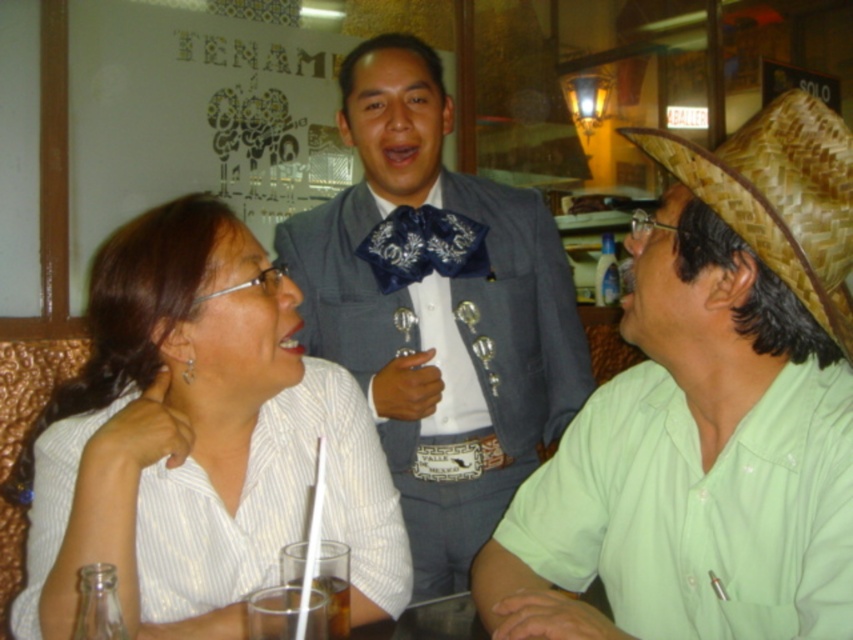
Is matte gray suit at center wider than translucent glass at table center?

Indeed, matte gray suit at center has a greater width compared to translucent glass at table center.

Is point (376, 420) more distant than point (329, 627)?

Yes, it is.

Where is `matte gray suit at center`? Image resolution: width=853 pixels, height=640 pixels. matte gray suit at center is located at coordinates (437, 308).

Based on the photo, who is more forward, (680, 442) or (18, 496)?

Point (680, 442) is in front.

What do you see at coordinates (708, 410) in the screenshot? The width and height of the screenshot is (853, 640). I see `green straw hat at right` at bounding box center [708, 410].

In order to click on green straw hat at right in this screenshot , I will do `click(708, 410)`.

Does dark blue satin bow tie at center have a greater height compared to translucent glass at table center?

Correct, dark blue satin bow tie at center is much taller as translucent glass at table center.

Who is more forward, (413, 218) or (334, 593)?

Point (334, 593) is in front.

This screenshot has width=853, height=640. Identify the location of dark blue satin bow tie at center. (422, 246).

Image resolution: width=853 pixels, height=640 pixels. In order to click on dark blue satin bow tie at center in this screenshot , I will do `click(422, 246)`.